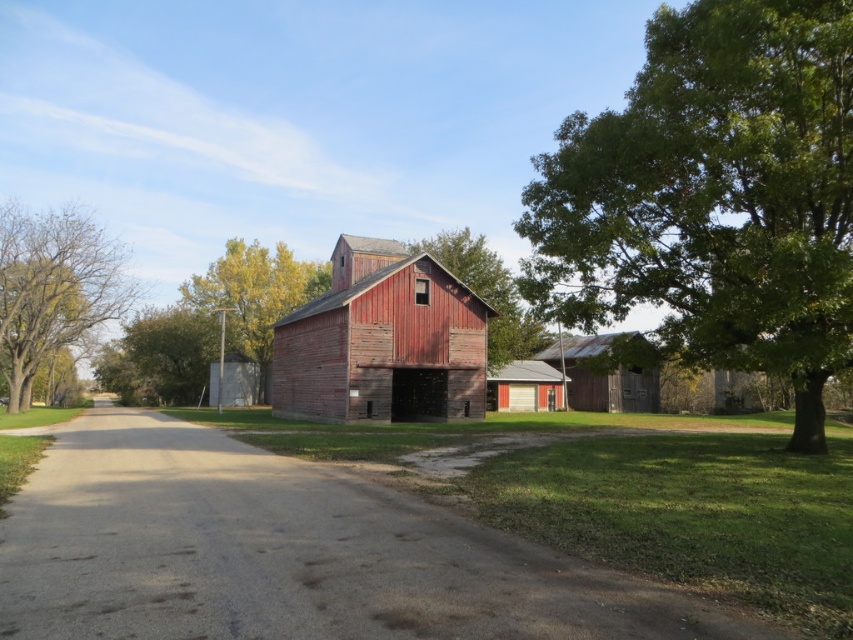
You are standing in the middle of the field and want to take a photo of both the smooth brown tree at left and the smooth wooden barn at center. Which object should you frame first in your camera to ensure both are fully visible in the photo?

You should frame the smooth wooden barn at center first because it occupies more space than the smooth brown tree at left, ensuring both are fully visible in the photo.